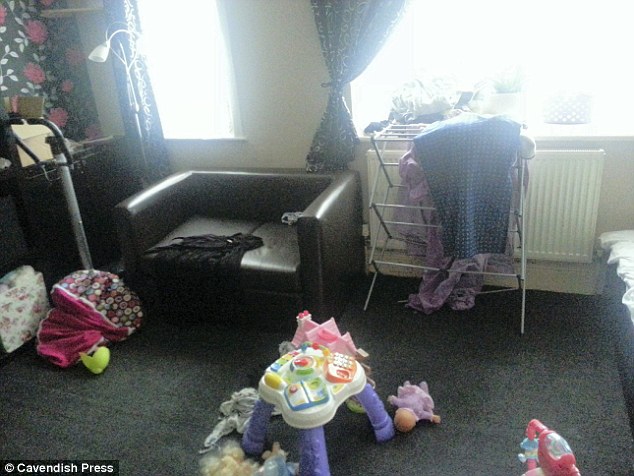
Find the location of a particular element. radiator is located at coordinates (559, 237).